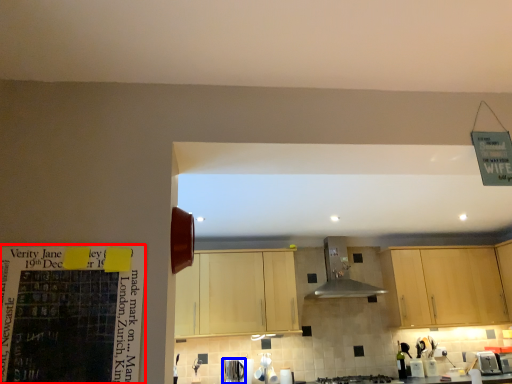
Question: Which object appears farthest to the camera in this image, bulletin board (highlighted by a red box) or appliance (highlighted by a blue box)?

Choices:
 (A) bulletin board
 (B) appliance

Answer: (B)